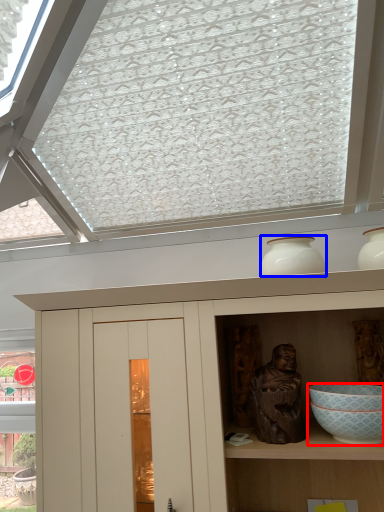
Question: Which object appears farthest to the camera in this image, bowl (highlighted by a red box) or vase (highlighted by a blue box)?

Choices:
 (A) bowl
 (B) vase

Answer: (B)